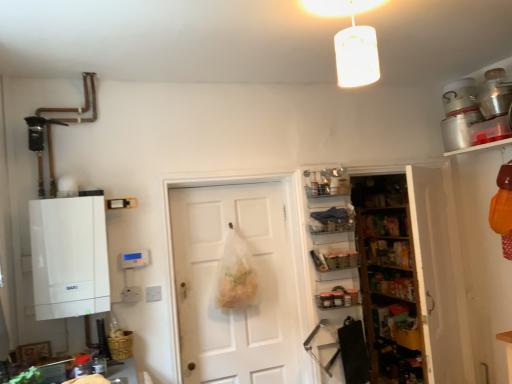
Question: Can you confirm if metallic silver pot at upper right, the 1th appliance viewed from the front, is thinner than white matte boiler at left?

Choices:
 (A) yes
 (B) no

Answer: (B)

Question: Is the depth of metallic silver pot at upper right, the 1th appliance viewed from the front, less than that of white matte boiler at left?

Choices:
 (A) no
 (B) yes

Answer: (A)

Question: From the image's perspective, is metallic silver pot at upper right, the 1th appliance viewed from the front, below white matte boiler at left?

Choices:
 (A) yes
 (B) no

Answer: (B)

Question: Is metallic silver pot at upper right, acting as the 2th appliance starting from the back, not inside white matte boiler at left?

Choices:
 (A) yes
 (B) no

Answer: (A)

Question: Does metallic silver pot at upper right, acting as the 2th appliance starting from the back, have a greater width compared to white matte boiler at left?

Choices:
 (A) yes
 (B) no

Answer: (A)

Question: Is metallic silver pot at upper right, the 1th appliance viewed from the front, placed right next to white matte boiler at left?

Choices:
 (A) yes
 (B) no

Answer: (B)

Question: Can you confirm if white matte door at center is taller than clear plastic shelves at center, the first shelf when ordered from top to bottom?

Choices:
 (A) no
 (B) yes

Answer: (B)

Question: Is white matte door at center bigger than clear plastic shelves at center, the first shelf when ordered from top to bottom?

Choices:
 (A) yes
 (B) no

Answer: (A)

Question: From the image's perspective, does white matte door at center appear lower than clear plastic shelves at center, the 4th shelf from the bottom?

Choices:
 (A) yes
 (B) no

Answer: (A)

Question: From a real-world perspective, is white matte door at center under clear plastic shelves at center, the first shelf when ordered from top to bottom?

Choices:
 (A) yes
 (B) no

Answer: (A)

Question: Can you confirm if white matte door at center is thinner than clear plastic shelves at center, the first shelf when ordered from top to bottom?

Choices:
 (A) no
 (B) yes

Answer: (B)

Question: Would you consider white matte door at center to be distant from clear plastic shelves at center, the 4th shelf from the bottom?

Choices:
 (A) no
 (B) yes

Answer: (A)

Question: Would you say bamboo basket at lower left is outside silver metallic canister at upper right, the 2th appliance from the front?

Choices:
 (A) yes
 (B) no

Answer: (A)